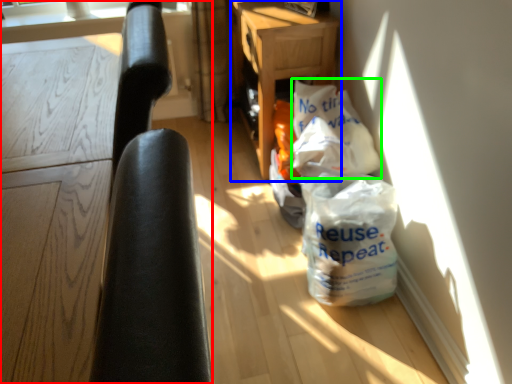
Question: Based on their relative distances, which object is nearer to furniture (highlighted by a red box)? Choose from table (highlighted by a blue box) and grocery bag (highlighted by a green box).

Choices:
 (A) table
 (B) grocery bag

Answer: (B)